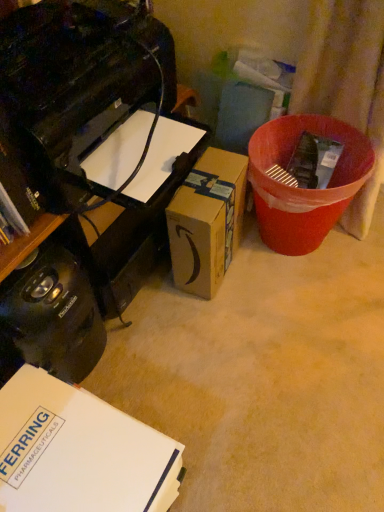
Question: From a real-world perspective, is white cardboard box at lower left, the first box when ordered from left to right, below black plastic toaster at lower left?

Choices:
 (A) no
 (B) yes

Answer: (B)

Question: From a real-world perspective, is white cardboard box at lower left, arranged as the first box when viewed from the front, over black plastic toaster at lower left?

Choices:
 (A) no
 (B) yes

Answer: (A)

Question: Are white cardboard box at lower left, arranged as the first box when viewed from the front, and black plastic toaster at lower left far apart?

Choices:
 (A) no
 (B) yes

Answer: (A)

Question: Considering the relative sizes of white cardboard box at lower left, placed as the 2th box when sorted from back to front, and black plastic toaster at lower left in the image provided, is white cardboard box at lower left, placed as the 2th box when sorted from back to front, thinner than black plastic toaster at lower left?

Choices:
 (A) yes
 (B) no

Answer: (B)

Question: Is black plastic toaster at lower left located within white cardboard box at lower left, arranged as the first box when viewed from the front?

Choices:
 (A) no
 (B) yes

Answer: (A)

Question: Would you say black plastic toaster at lower left is to the left or to the right of brown cardboard box at center, arranged as the 2th box when viewed from the left, in the picture?

Choices:
 (A) right
 (B) left

Answer: (B)

Question: Is black plastic toaster at lower left inside the boundaries of brown cardboard box at center, which is the 2th box in front-to-back order, or outside?

Choices:
 (A) inside
 (B) outside

Answer: (B)

Question: Is point (54, 361) closer or farther from the camera than point (220, 202)?

Choices:
 (A) closer
 (B) farther

Answer: (A)

Question: From a real-world perspective, is black plastic toaster at lower left positioned above or below brown cardboard box at center, the 1th box from the back?

Choices:
 (A) below
 (B) above

Answer: (B)

Question: Looking at their shapes, would you say red plastic bin at right is wider or thinner than brown cardboard box at center, arranged as the 2th box when viewed from the left?

Choices:
 (A) wide
 (B) thin

Answer: (A)

Question: From their relative heights in the image, would you say red plastic bin at right is taller or shorter than brown cardboard box at center, the 1th box from the back?

Choices:
 (A) short
 (B) tall

Answer: (B)

Question: Considering the positions of point (258, 132) and point (195, 210), is point (258, 132) closer or farther from the camera than point (195, 210)?

Choices:
 (A) closer
 (B) farther

Answer: (B)

Question: In the image, is red plastic bin at right on the left side or the right side of brown cardboard box at center, arranged as the 2th box when viewed from the left?

Choices:
 (A) right
 (B) left

Answer: (A)

Question: Do you think black glossy printer at upper left is within white cardboard box at lower left, the first box when ordered from left to right, or outside of it?

Choices:
 (A) outside
 (B) inside

Answer: (A)

Question: From a real-world perspective, relative to white cardboard box at lower left, placed as the 2th box when sorted from back to front, is black glossy printer at upper left vertically above or below?

Choices:
 (A) below
 (B) above

Answer: (B)